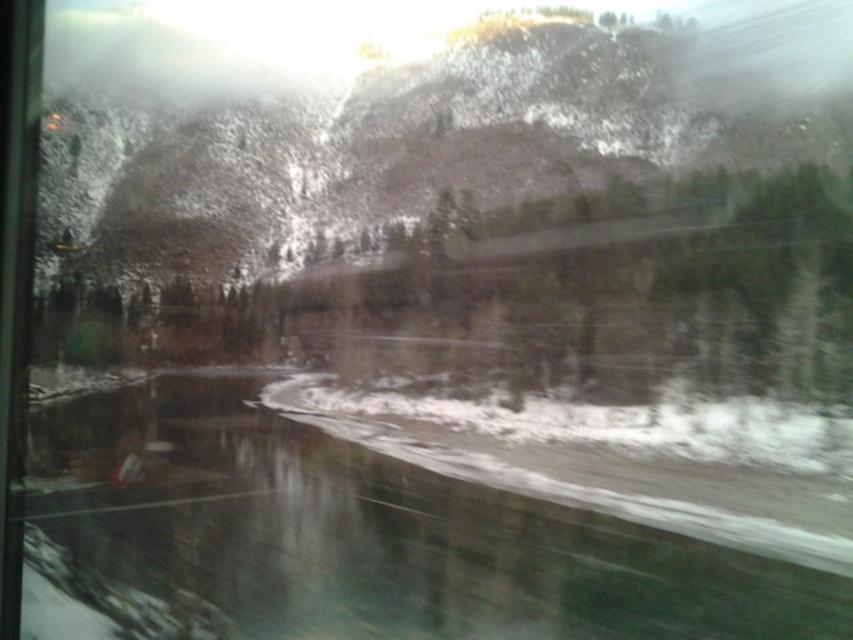
You are a passenger in a car and looking out the window. You see a clear water at bottom and white powdery snow at center. Which one appears taller in the scene?

The clear water at bottom appears taller than the white powdery snow at center because the description states that clear water at bottom is much taller as white powdery snow at center.